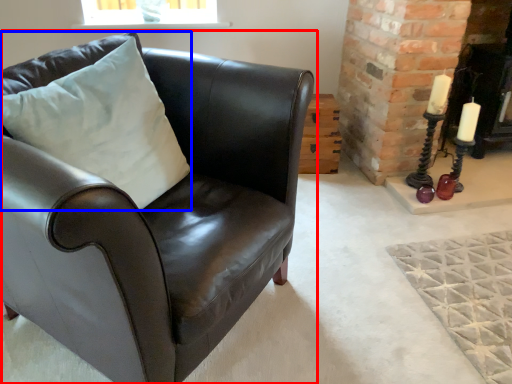
Question: Which point is further to the camera, chair (highlighted by a red box) or pillow (highlighted by a blue box)?

Choices:
 (A) chair
 (B) pillow

Answer: (B)